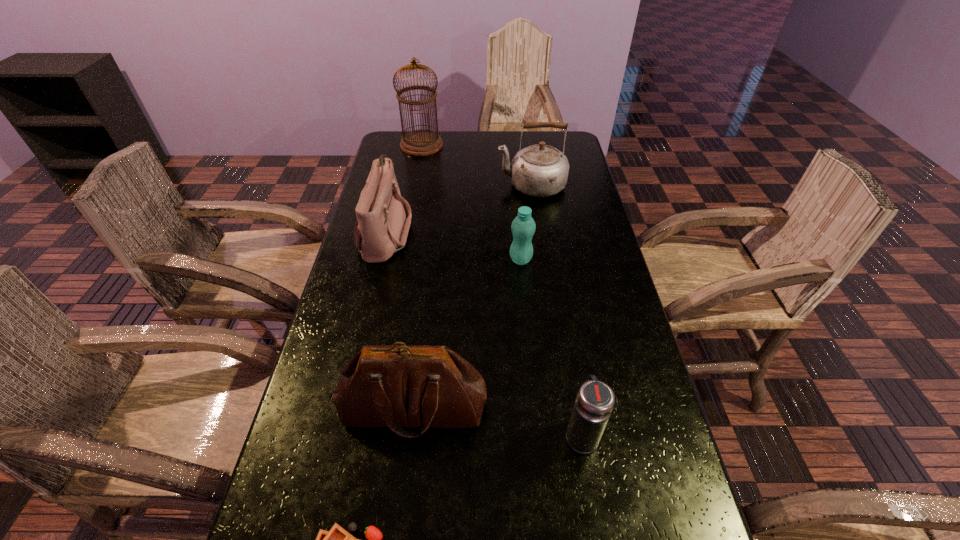
Locate an element on the screen. vacant area that lies between the nearer shoulder bag and the tallest object is located at coordinates (418, 276).

Identify the location of empty space that is in between the bottle and the shorter shoulder bag. Image resolution: width=960 pixels, height=540 pixels. (453, 246).

Locate an element on the screen. free space that is in between the tallest object and the thermos bottle is located at coordinates (501, 290).

What are the coordinates of `vacant point located between the shorter shoulder bag and the thermos bottle` in the screenshot? It's located at (484, 333).

The image size is (960, 540). Find the location of `object that is the sixth closest to the shorter shoulder bag`. object that is the sixth closest to the shorter shoulder bag is located at coordinates 337,539.

The width and height of the screenshot is (960, 540). I want to click on object that is the closest one to the birdcage, so click(541, 170).

Locate an element on the screen. blank space that satisfies the following two spatial constraints: 1. with a handle on the side of the thermos bottle; 2. on the front pocket of the shorter shoulder bag is located at coordinates (547, 232).

I want to click on free space that satisfies the following two spatial constraints: 1. on the front pocket of the shorter shoulder bag; 2. on the right side of the nearer shoulder bag, so click(x=344, y=407).

Locate an element on the screen. This screenshot has height=540, width=960. free spot that satisfies the following two spatial constraints: 1. with a handle on the side of the thermos bottle; 2. on the front-facing side of the tallest object is located at coordinates (533, 145).

Identify the location of blank area in the image that satisfies the following two spatial constraints: 1. on the front-facing side of the farthest object; 2. at the spout of the kettle. The image size is (960, 540). (414, 185).